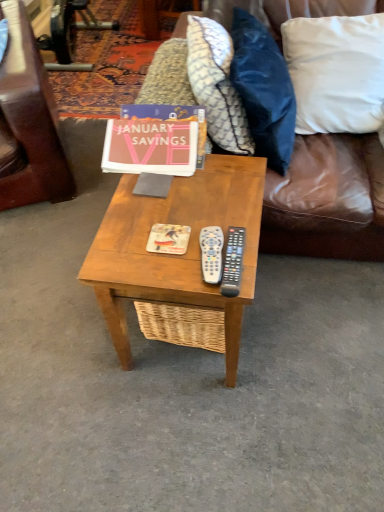
The width and height of the screenshot is (384, 512). I want to click on vacant area that lies between white plastic remote at center, which is the first remote from left to right, and matte orange magazine at center, so click(185, 259).